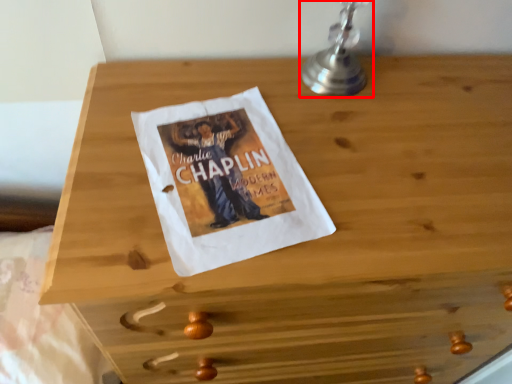
Question: From the image's perspective, where is table lamp (annotated by the red box) located in relation to sheet in the image?

Choices:
 (A) above
 (B) below

Answer: (A)